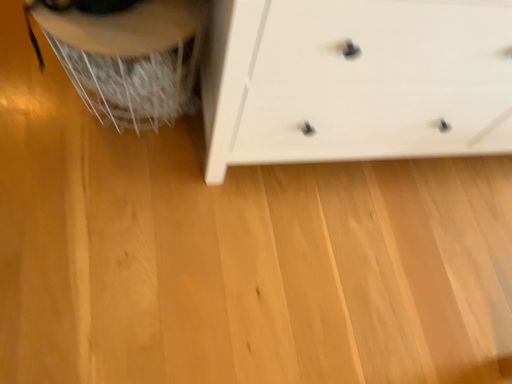
Question: Should I look upward or downward to see white plastic swivel chair at left?

Choices:
 (A) down
 (B) up

Answer: (B)

Question: Does white plastic swivel chair at left come in front of white matte chest of drawers at center?

Choices:
 (A) no
 (B) yes

Answer: (A)

Question: Can you confirm if white plastic swivel chair at left is thinner than white matte chest of drawers at center?

Choices:
 (A) no
 (B) yes

Answer: (B)

Question: Does white plastic swivel chair at left have a larger size compared to white matte chest of drawers at center?

Choices:
 (A) yes
 (B) no

Answer: (B)

Question: Does white plastic swivel chair at left touch white matte chest of drawers at center?

Choices:
 (A) yes
 (B) no

Answer: (B)

Question: Is white plastic swivel chair at left shorter than white matte chest of drawers at center?

Choices:
 (A) no
 (B) yes

Answer: (B)

Question: Is white plastic swivel chair at left at the right side of white matte chest of drawers at center?

Choices:
 (A) yes
 (B) no

Answer: (B)

Question: Is white matte chest of drawers at center next to white plastic swivel chair at left?

Choices:
 (A) no
 (B) yes

Answer: (A)

Question: Considering the relative sizes of white matte chest of drawers at center and white plastic swivel chair at left in the image provided, is white matte chest of drawers at center thinner than white plastic swivel chair at left?

Choices:
 (A) yes
 (B) no

Answer: (B)

Question: From a real-world perspective, is white matte chest of drawers at center located higher than white plastic swivel chair at left?

Choices:
 (A) no
 (B) yes

Answer: (B)

Question: Does white matte chest of drawers at center have a lesser height compared to white plastic swivel chair at left?

Choices:
 (A) yes
 (B) no

Answer: (B)

Question: Is white plastic swivel chair at left at the back of white matte chest of drawers at center?

Choices:
 (A) no
 (B) yes

Answer: (A)

Question: Is white matte chest of drawers at center at the left side of white plastic swivel chair at left?

Choices:
 (A) no
 (B) yes

Answer: (A)

Question: Relative to white matte chest of drawers at center, is white plastic swivel chair at left in front or behind?

Choices:
 (A) behind
 (B) front

Answer: (A)